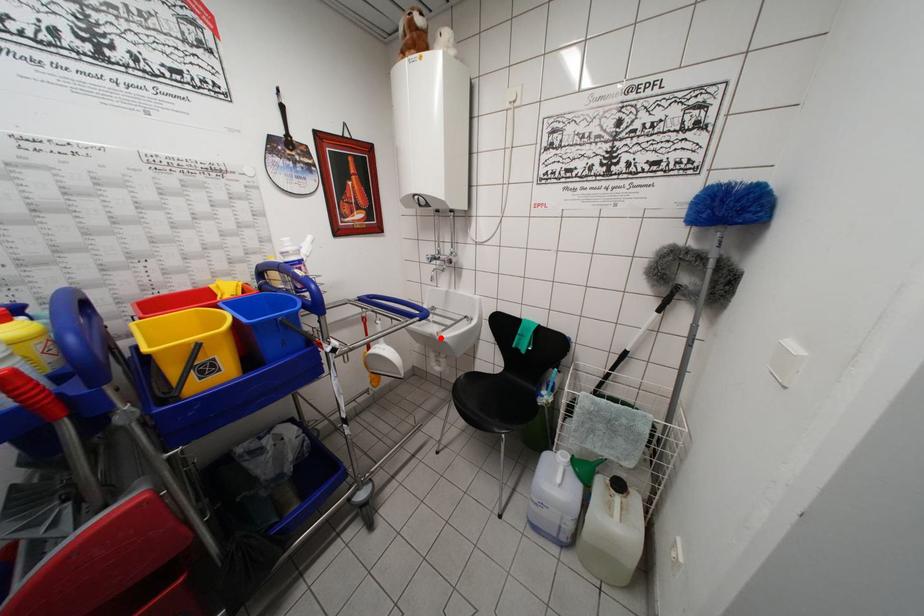
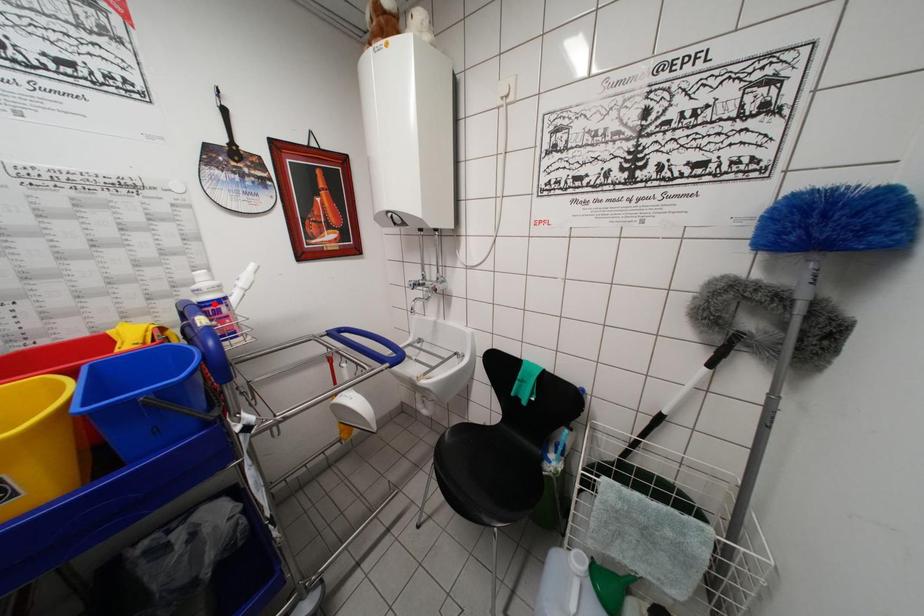
I am providing you with two images of the same scene from different viewpoints. A red point is marked on the first image and another point is marked on the second image. Is the red point in image1 aligned with the point shown in image2?

No